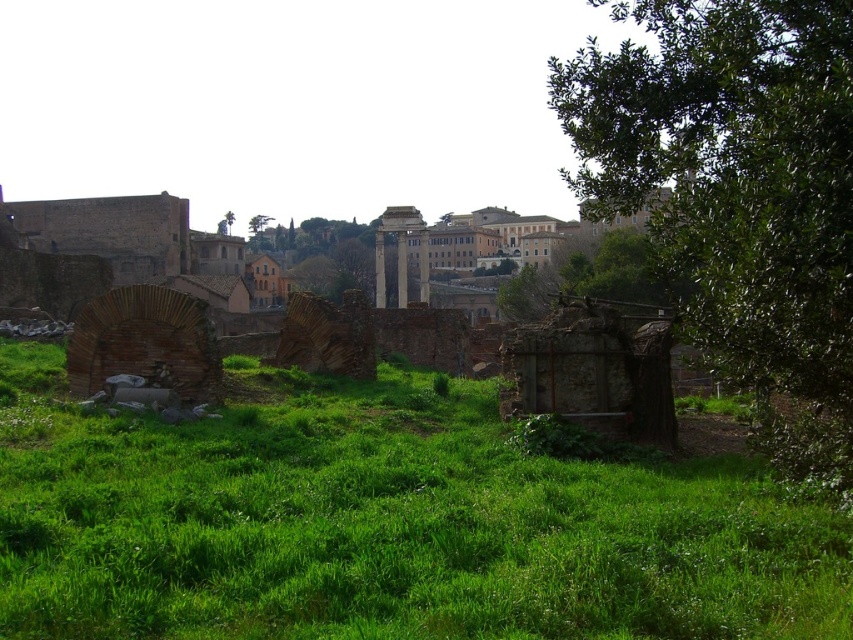
Question: Is green grassy at center below green leafy tree at right?

Choices:
 (A) yes
 (B) no

Answer: (A)

Question: Which object is closer to the camera taking this photo?

Choices:
 (A) green leafy tree at right
 (B) green grassy at center
 (C) green leafy tree at upper center

Answer: (B)

Question: Can you confirm if green grassy at center is thinner than green leafy tree at upper center?

Choices:
 (A) yes
 (B) no

Answer: (B)

Question: Does green grassy at center appear over green leafy tree at upper center?

Choices:
 (A) yes
 (B) no

Answer: (B)

Question: Among these points, which one is farthest from the camera?

Choices:
 (A) (712, 356)
 (B) (184, 572)

Answer: (A)

Question: Considering the real-world distances, which object is farthest from the green grassy at center?

Choices:
 (A) green leafy tree at upper center
 (B) green leafy tree at right

Answer: (A)